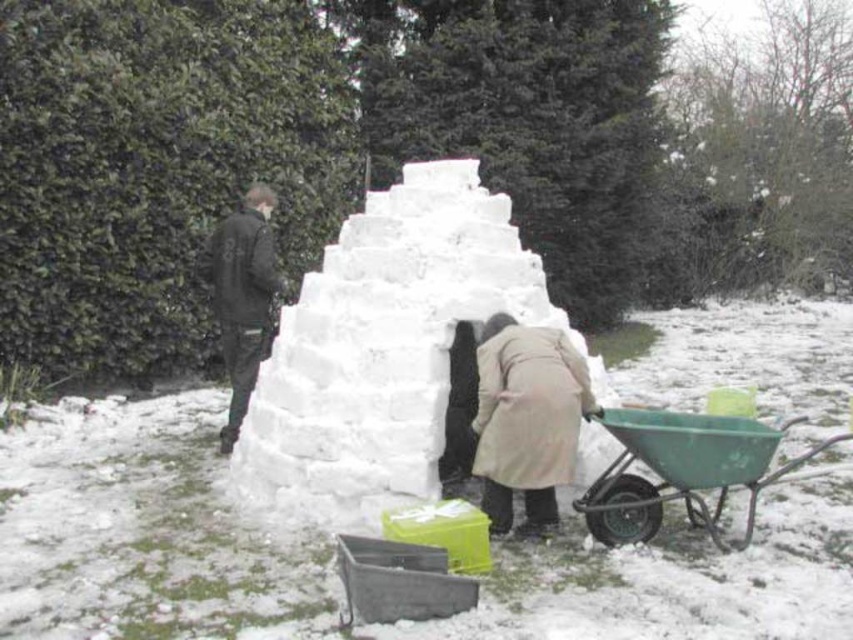
Which of these two, light beige coat at center or black matte jacket at left, stands taller?

black matte jacket at left

Does point (550, 528) come closer to viewer compared to point (230, 369)?

Yes, it is.

Who is more forward, (x=546, y=362) or (x=254, y=374)?

Positioned in front is point (x=546, y=362).

Find the location of `light beige coat at center`. light beige coat at center is located at coordinates (526, 419).

Between green leafy hedge at upper left and white snow igloo at center, which one has less height?

With less height is white snow igloo at center.

Does green leafy hedge at upper left appear on the right side of white snow igloo at center?

In fact, green leafy hedge at upper left is to the left of white snow igloo at center.

Is point (119, 342) farther from viewer compared to point (422, 371)?

Yes, point (119, 342) is farther from viewer.

Locate an element on the screen. This screenshot has height=640, width=853. green leafy hedge at upper left is located at coordinates (157, 170).

Is green leafy hedge at upper left wider than black matte jacket at left?

Indeed, green leafy hedge at upper left has a greater width compared to black matte jacket at left.

Image resolution: width=853 pixels, height=640 pixels. Describe the element at coordinates (157, 170) in the screenshot. I see `green leafy hedge at upper left` at that location.

Does point (329, 90) come in front of point (250, 259)?

No, it is not.

What are the coordinates of `green leafy hedge at upper left` in the screenshot? It's located at (157, 170).